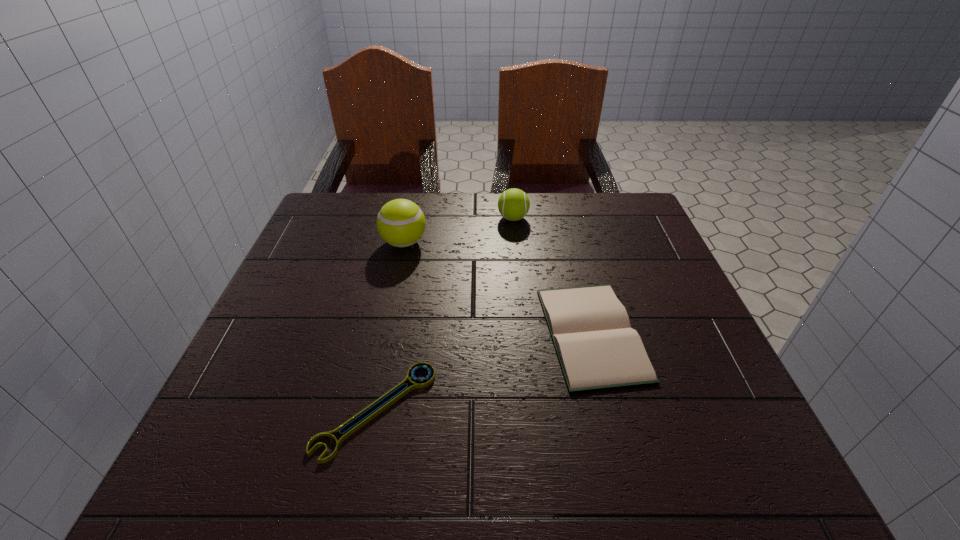
Where is `vacant space that satisfies the following two spatial constraints: 1. on the back side of the hardback book; 2. on the left side of the wrench`? vacant space that satisfies the following two spatial constraints: 1. on the back side of the hardback book; 2. on the left side of the wrench is located at coordinates (392, 334).